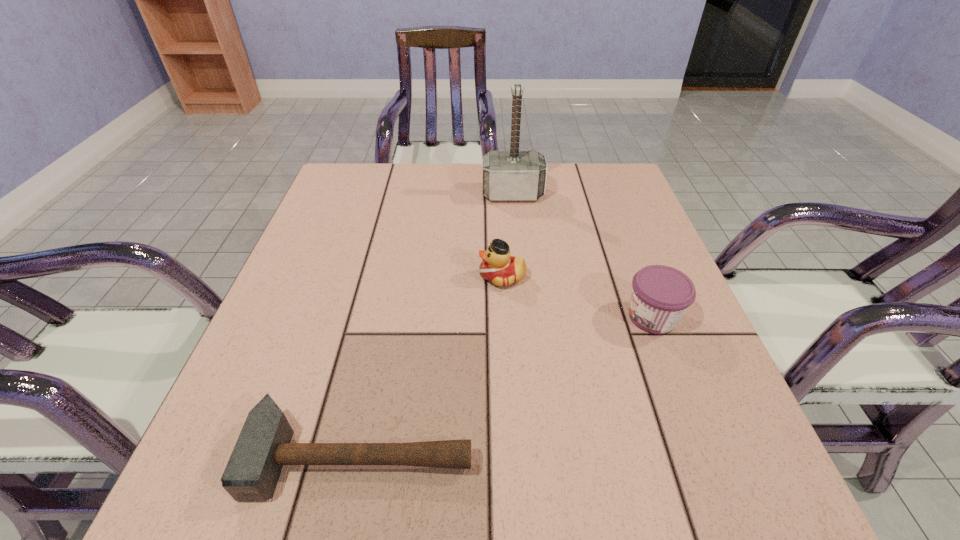
Identify the location of the tallest object. The image size is (960, 540). (514, 175).

You are a GUI agent. You are given a task and a screenshot of the screen. Output one action in this format:
    pyautogui.click(x=<x>, y=<y>)
    Task: Click on the farther hammer
    
    Given the screenshot: What is the action you would take?
    pyautogui.click(x=514, y=175)

The width and height of the screenshot is (960, 540). What are the coordinates of `the third nearest object` in the screenshot? It's located at (497, 267).

This screenshot has width=960, height=540. I want to click on jam, so click(x=660, y=296).

Locate an element on the screen. This screenshot has width=960, height=540. the rightmost object is located at coordinates (660, 296).

You are a GUI agent. You are given a task and a screenshot of the screen. Output one action in this format:
    pyautogui.click(x=<x>, y=<y>)
    Task: Click on the shorter hammer
    This screenshot has width=960, height=540.
    Given the screenshot: What is the action you would take?
    coord(264,445)

Find the location of a particular element. This screenshot has height=540, width=960. the left hammer is located at coordinates (264, 445).

Locate an element on the screen. Image resolution: width=960 pixels, height=540 pixels. vacant space located 0.380m for striking with the head of the tallest object is located at coordinates (525, 314).

This screenshot has height=540, width=960. What are the coordinates of `vacant space located on the face of the second farthest object` in the screenshot? It's located at (356, 276).

I want to click on vacant space located 0.160m on the face of the second farthest object, so click(403, 276).